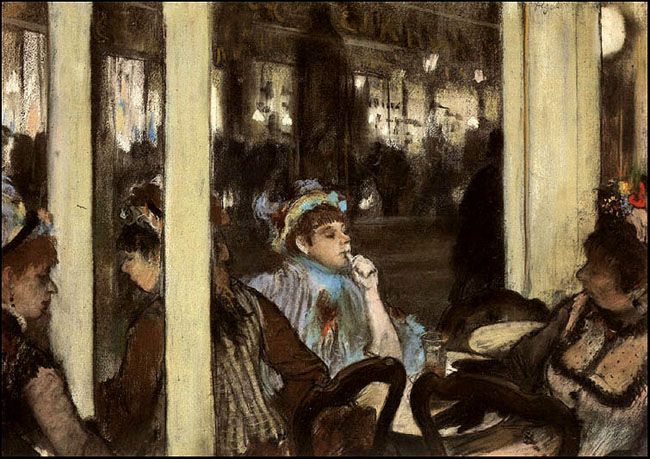
The image size is (650, 459). I want to click on chair, so 448,376, 391,376.